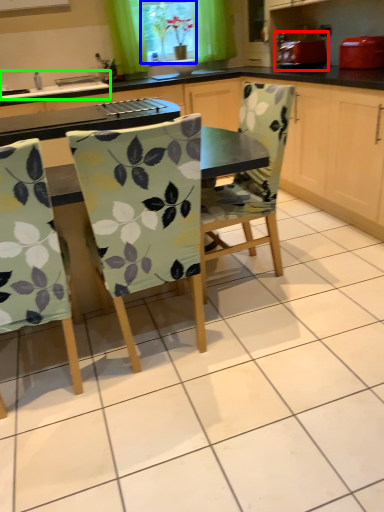
Question: Which object is the farthest from appliance (highlighted by a red box)? Choose among these: window screen (highlighted by a blue box) or sink (highlighted by a green box).

Choices:
 (A) window screen
 (B) sink

Answer: (B)